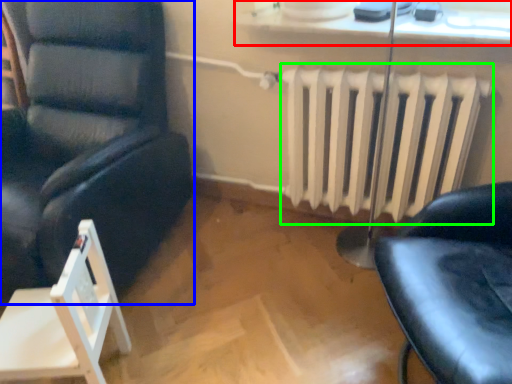
Question: Estimate the real-world distances between objects in this image. Which object is closer to window sill (highlighted by a red box), chair (highlighted by a blue box) or radiator (highlighted by a green box)?

Choices:
 (A) chair
 (B) radiator

Answer: (B)